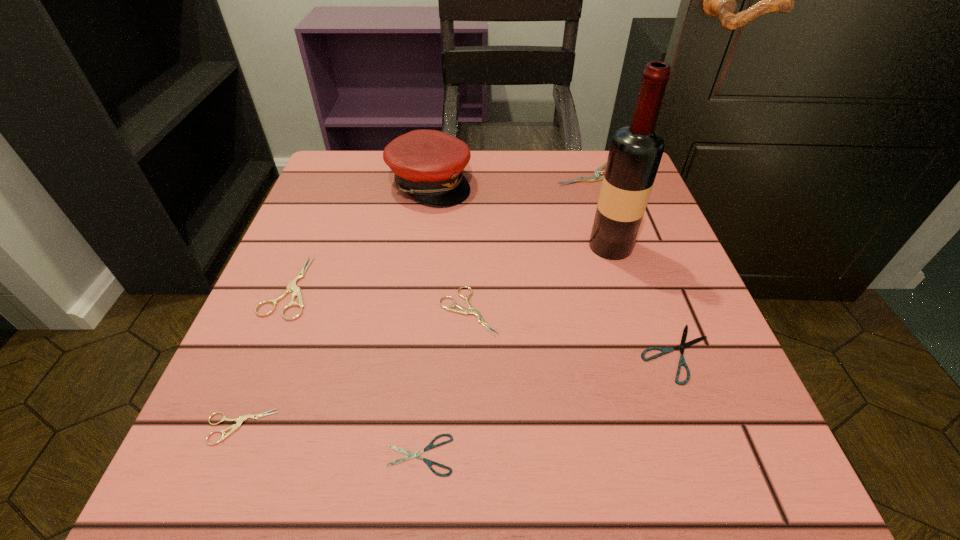
Where is `the closest beige shears to the wine bottle`? The width and height of the screenshot is (960, 540). the closest beige shears to the wine bottle is located at coordinates (596, 176).

I want to click on vacant space that satisfies the following two spatial constraints: 1. on the front side of the third beige shears from left to right; 2. on the left side of the bigger black shears, so click(x=468, y=353).

Where is `free space that satisfies the following two spatial constraints: 1. on the front-facing side of the second tallest object; 2. on the right side of the tallest object`? The width and height of the screenshot is (960, 540). free space that satisfies the following two spatial constraints: 1. on the front-facing side of the second tallest object; 2. on the right side of the tallest object is located at coordinates (420, 246).

Image resolution: width=960 pixels, height=540 pixels. I want to click on vacant region that satisfies the following two spatial constraints: 1. on the front side of the left black shears; 2. on the left side of the fifth shortest object, so click(219, 455).

What are the coordinates of `vacant region that satisfies the following two spatial constraints: 1. on the front-facing side of the fifth tallest object; 2. on the left side of the red cap` in the screenshot? It's located at (411, 311).

This screenshot has width=960, height=540. Find the location of `vacant region that satisfies the following two spatial constraints: 1. on the back side of the tallest object; 2. on the front-facing side of the cap`. vacant region that satisfies the following two spatial constraints: 1. on the back side of the tallest object; 2. on the front-facing side of the cap is located at coordinates (590, 184).

Identify the location of vacant space that satisfies the following two spatial constraints: 1. on the front side of the shortest object; 2. on the left side of the nearest beige shears. (228, 455).